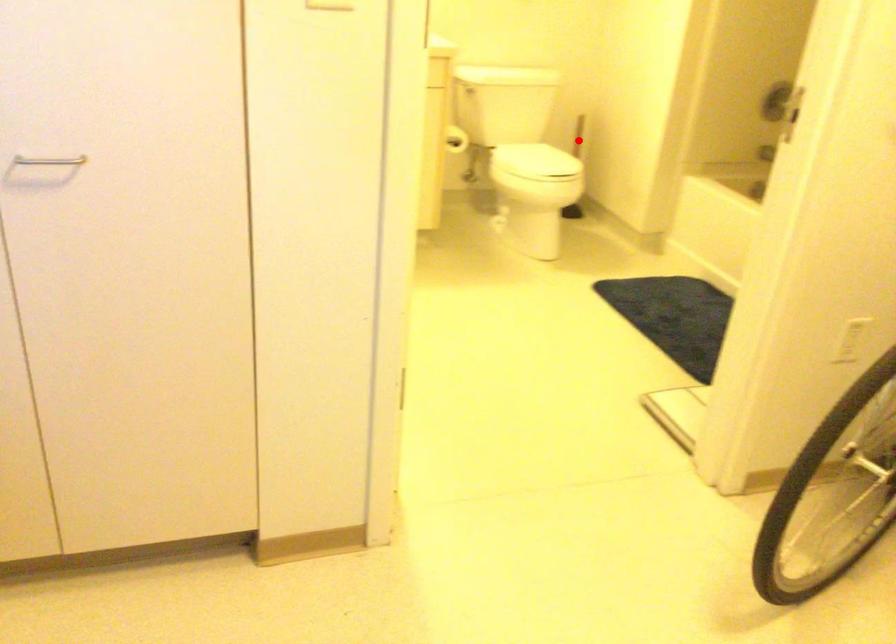
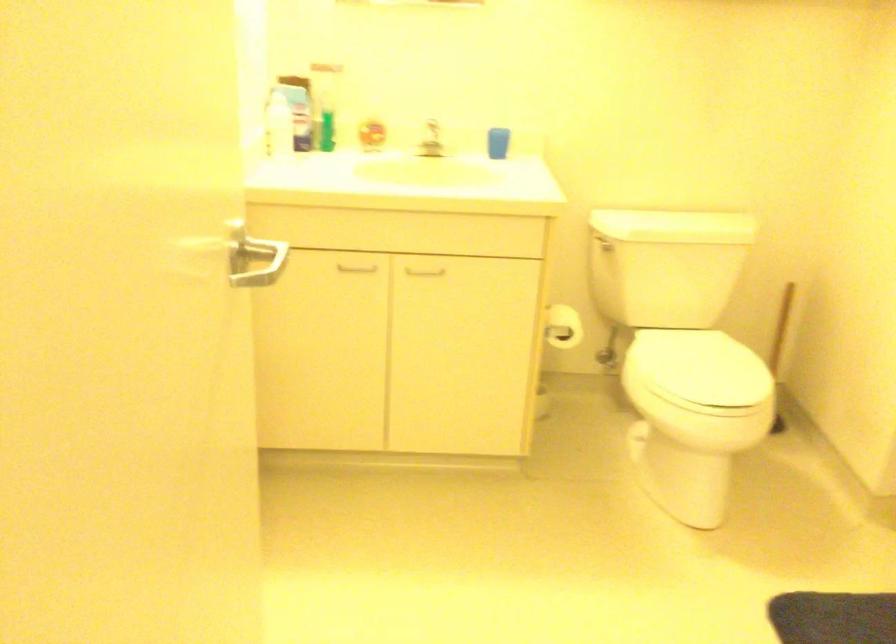
Question: I am providing you with two images of the same scene from different viewpoints. A red point is marked on the first image. Can you still see the location of the red point in image 2?

Choices:
 (A) Yes
 (B) No

Answer: (A)